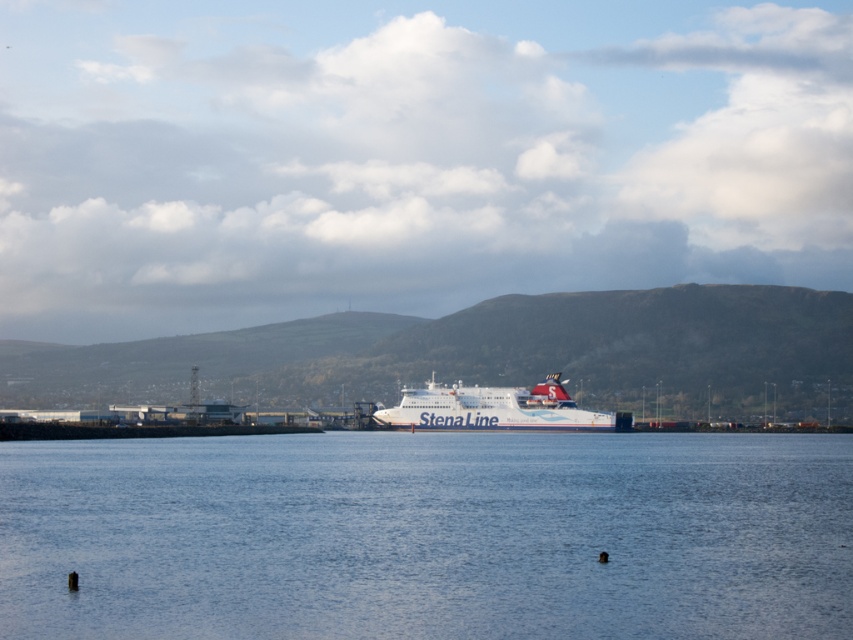
Does point (408, 632) come closer to viewer compared to point (413, 408)?

Yes, point (408, 632) is closer to viewer.

Is blue water at center further to camera compared to white matte ferry at center?

No, blue water at center is closer to the viewer.

The height and width of the screenshot is (640, 853). In order to click on blue water at center in this screenshot , I will do `click(428, 536)`.